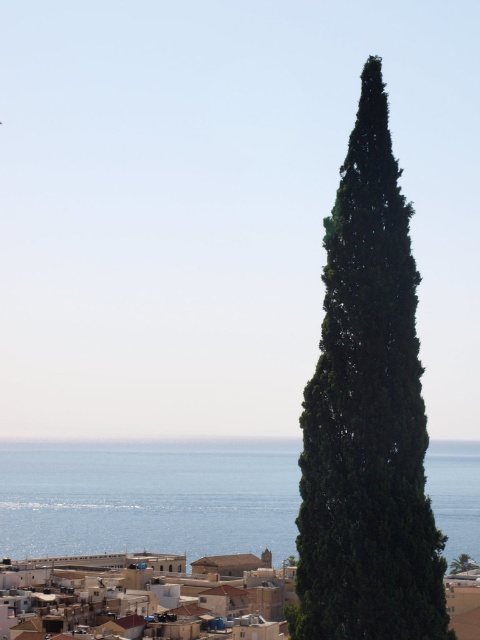
Does green leafy cypress at center appear over blue liquid water at center?

Indeed, green leafy cypress at center is positioned over blue liquid water at center.

Who is positioned more to the left, green leafy cypress at center or blue liquid water at center?

blue liquid water at center

Describe the element at coordinates (368, 417) in the screenshot. I see `green leafy cypress at center` at that location.

Where is `green leafy cypress at center`? The image size is (480, 640). green leafy cypress at center is located at coordinates pyautogui.click(x=368, y=417).

Can you confirm if blue liquid water at center is shorter than white matte building at lower center?

Incorrect, blue liquid water at center's height does not fall short of white matte building at lower center's.

Between blue liquid water at center and white matte building at lower center, which one has more height?

blue liquid water at center

Between point (469, 502) and point (249, 572), which one is positioned behind?

Point (469, 502)

This screenshot has height=640, width=480. I want to click on blue liquid water at center, so click(x=147, y=497).

Based on the photo, between green leafy cypress at center and white matte building at lower center, which one has less height?

green leafy cypress at center is shorter.

What do you see at coordinates (368, 417) in the screenshot? The width and height of the screenshot is (480, 640). I see `green leafy cypress at center` at bounding box center [368, 417].

I want to click on green leafy cypress at center, so click(368, 417).